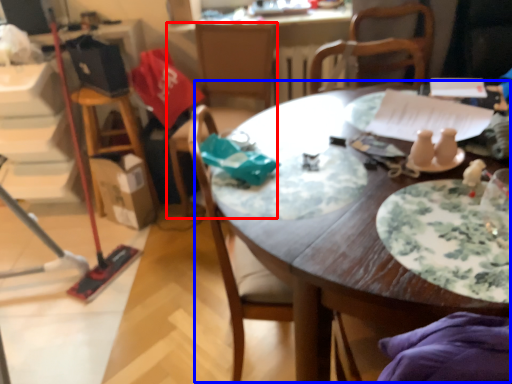
Question: Which object is closer to the camera taking this photo, chair (highlighted by a red box) or table (highlighted by a blue box)?

Choices:
 (A) chair
 (B) table

Answer: (B)